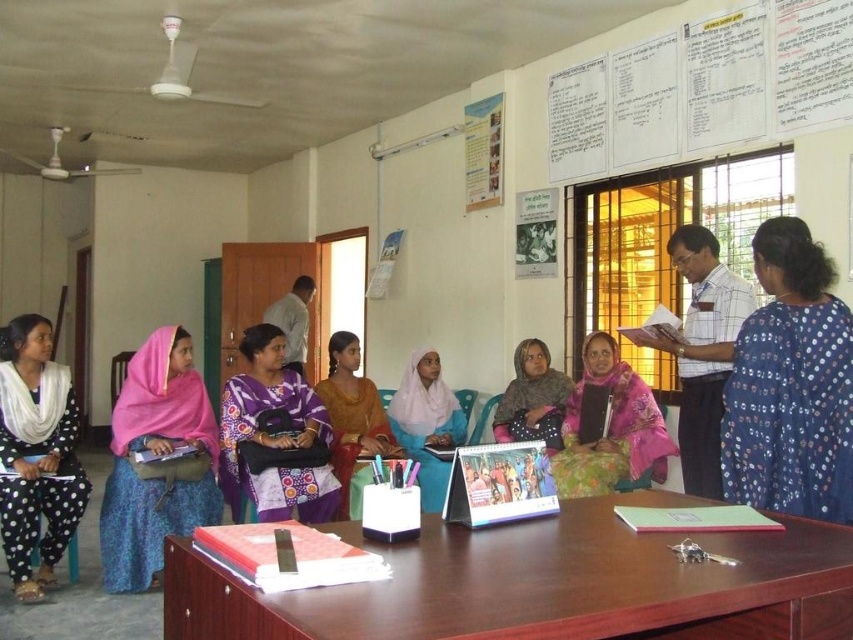
Question: Estimate the real-world distances between objects in this image. Which object is farther from the blue dotted saree at right?

Choices:
 (A) purple printed dress at center
 (B) pink fabric headscarf at left

Answer: (B)

Question: Which point is farther from the camera taking this photo?

Choices:
 (A) (579, 396)
 (B) (137, 577)

Answer: (A)

Question: Where is purple printed dress at center located in relation to matte pink scarf at center in the image?

Choices:
 (A) right
 (B) left

Answer: (B)

Question: Is purple printed dress at center to the right of orange fabric dress at center from the viewer's perspective?

Choices:
 (A) yes
 (B) no

Answer: (B)

Question: Which point is farther to the camera?

Choices:
 (A) (456, 428)
 (B) (247, 492)

Answer: (A)

Question: Is black polka dot dress at left bigger than white fabric hijab at center?

Choices:
 (A) no
 (B) yes

Answer: (A)